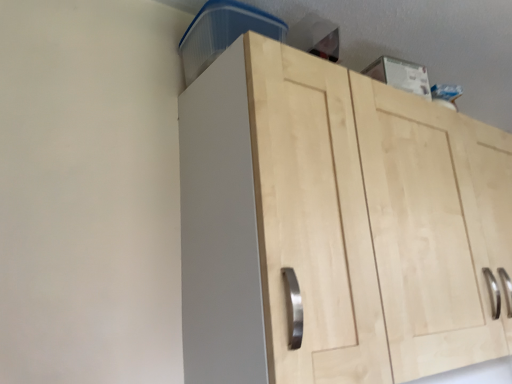
At what (x,y) coordinates should I click in order to perform the action: click on natural wood cupboard at upper right. Please return your answer as a coordinate pair (x, y). The image size is (512, 384). Looking at the image, I should click on (336, 225).

What do you see at coordinates (336, 225) in the screenshot? Image resolution: width=512 pixels, height=384 pixels. I see `natural wood cupboard at upper right` at bounding box center [336, 225].

Identify the location of natural wood cupboard at upper right. (336, 225).